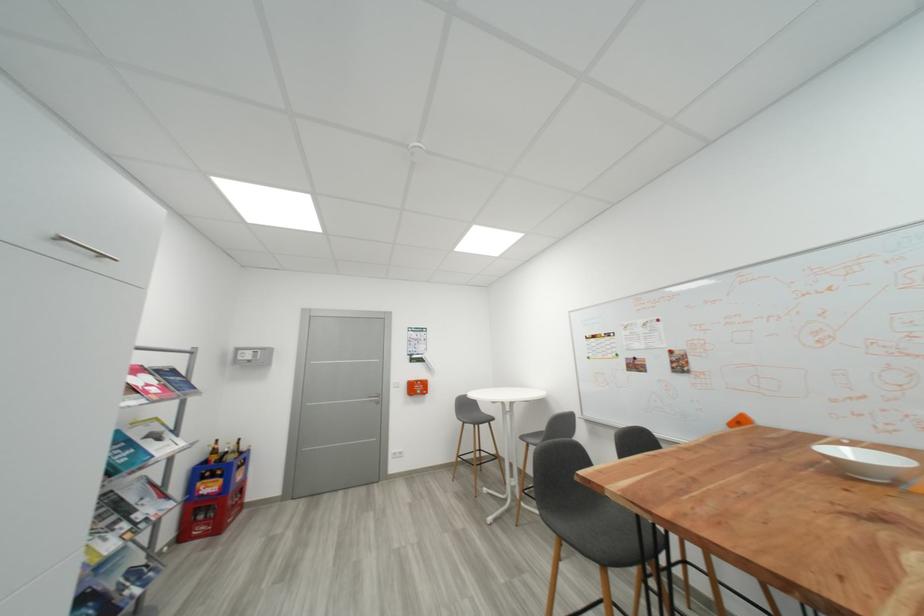
You are a GUI agent. You are given a task and a screenshot of the screen. Output one action in this format:
    pyautogui.click(x=<x>, y=<y>)
    Task: Click on the white ceramic bowl
    The width and height of the screenshot is (924, 616).
    Given the screenshot: What is the action you would take?
    pyautogui.click(x=868, y=463)